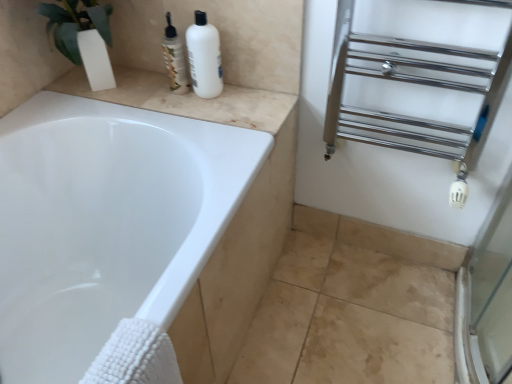
Question: Is beige marble counter top at upper left facing away from chrome/metal towel rack at right?

Choices:
 (A) no
 (B) yes

Answer: (A)

Question: From a real-world perspective, is beige marble counter top at upper left on top of chrome/metal towel rack at right?

Choices:
 (A) yes
 (B) no

Answer: (B)

Question: Is beige marble counter top at upper left thinner than chrome/metal towel rack at right?

Choices:
 (A) no
 (B) yes

Answer: (A)

Question: Would you say beige marble counter top at upper left contains chrome/metal towel rack at right?

Choices:
 (A) no
 (B) yes

Answer: (A)

Question: Is the position of beige marble counter top at upper left less distant than that of chrome/metal towel rack at right?

Choices:
 (A) no
 (B) yes

Answer: (A)

Question: From the image's perspective, is beige marble counter top at upper left above or below chrome/metal towel rack at right?

Choices:
 (A) below
 (B) above

Answer: (B)

Question: From their relative heights in the image, would you say beige marble counter top at upper left is taller or shorter than chrome/metal towel rack at right?

Choices:
 (A) tall
 (B) short

Answer: (B)

Question: In the image, is beige marble counter top at upper left on the left side or the right side of chrome/metal towel rack at right?

Choices:
 (A) right
 (B) left

Answer: (B)

Question: In terms of width, does beige marble counter top at upper left look wider or thinner when compared to chrome/metal towel rack at right?

Choices:
 (A) wide
 (B) thin

Answer: (A)

Question: Considering their positions, is translucent plastic bottles at upper center located in front of or behind white matte bottle at upper center?

Choices:
 (A) front
 (B) behind

Answer: (B)

Question: Looking at the image, does translucent plastic bottles at upper center seem bigger or smaller compared to white matte bottle at upper center?

Choices:
 (A) small
 (B) big

Answer: (A)

Question: In the image, is translucent plastic bottles at upper center on the left side or the right side of white matte bottle at upper center?

Choices:
 (A) right
 (B) left

Answer: (B)

Question: Is translucent plastic bottles at upper center spatially inside white matte bottle at upper center, or outside of it?

Choices:
 (A) inside
 (B) outside

Answer: (B)

Question: In the image, is chrome/metal towel rack at right positioned in front of or behind translucent plastic bottles at upper center?

Choices:
 (A) front
 (B) behind

Answer: (A)

Question: From their relative heights in the image, would you say chrome/metal towel rack at right is taller or shorter than translucent plastic bottles at upper center?

Choices:
 (A) short
 (B) tall

Answer: (B)